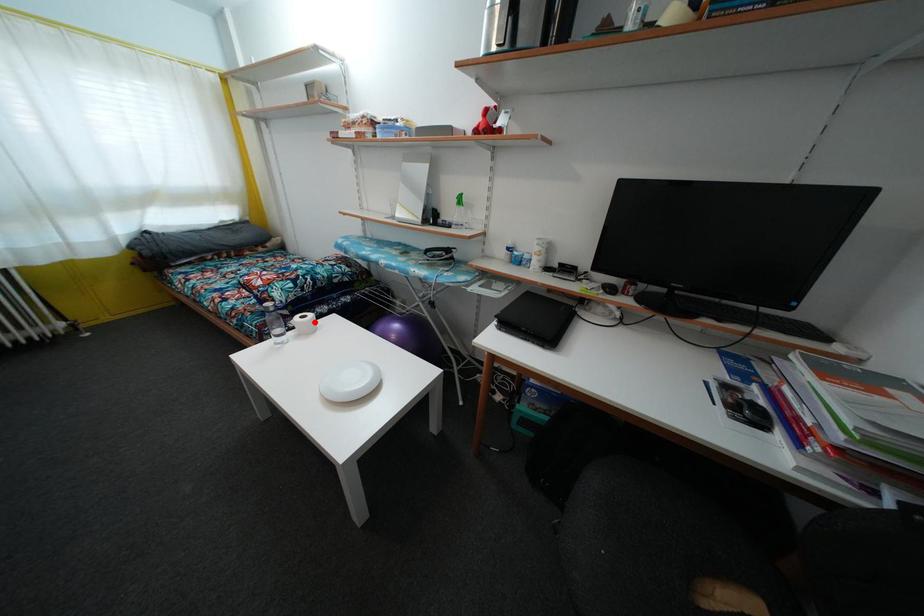
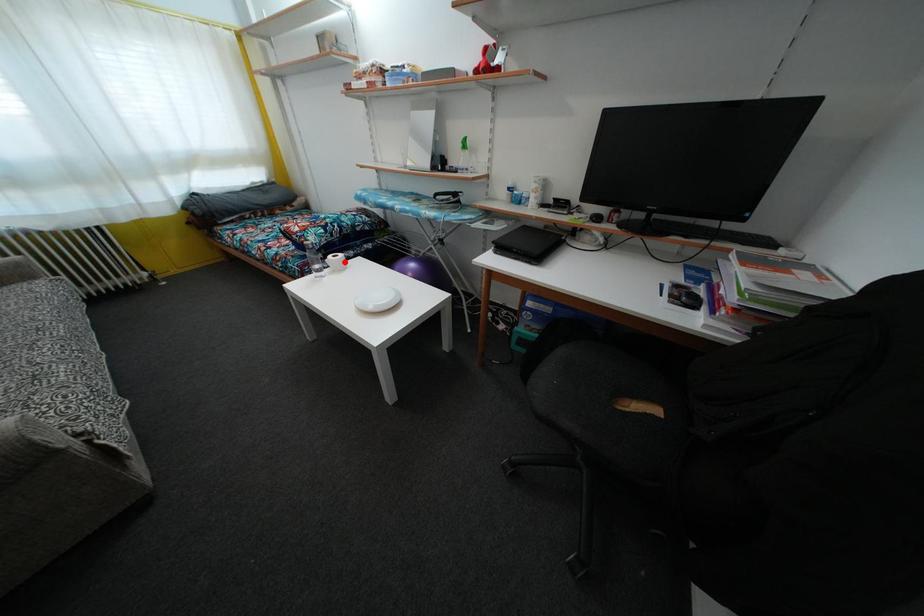
I am providing you with two images of the same scene from different viewpoints. A red point is marked on the first image and another point is marked on the second image. Does the point marked in image1 correspond to the same location as the one in image2?

Yes